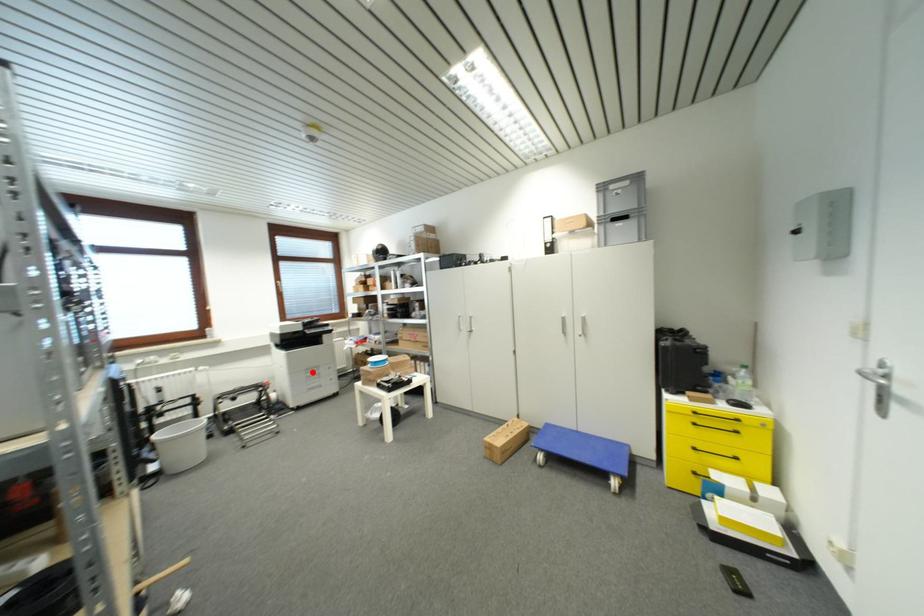
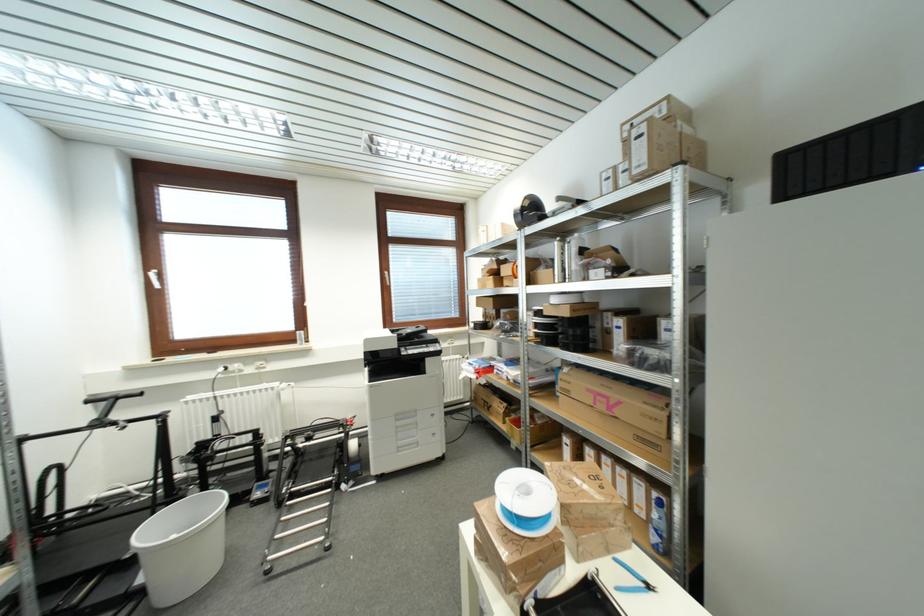
Where in the second image is the point corresponding to the highlighted location from the first image?

(403, 419)